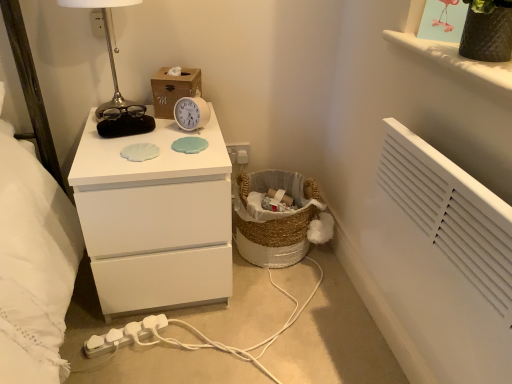
What are the coordinates of `free space in front of woven natural basket at lower center` in the screenshot? It's located at (288, 304).